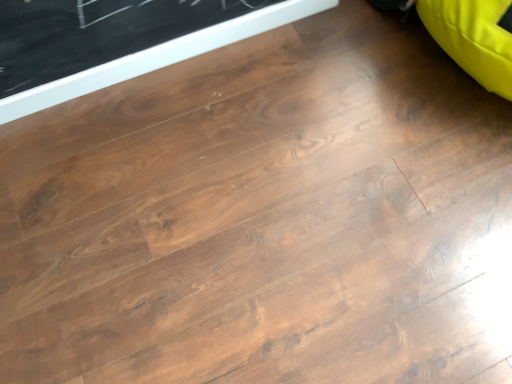
Image resolution: width=512 pixels, height=384 pixels. In order to click on unoccupied area in front of matte wood bulletin board at upper left in this screenshot , I will do `click(183, 197)`.